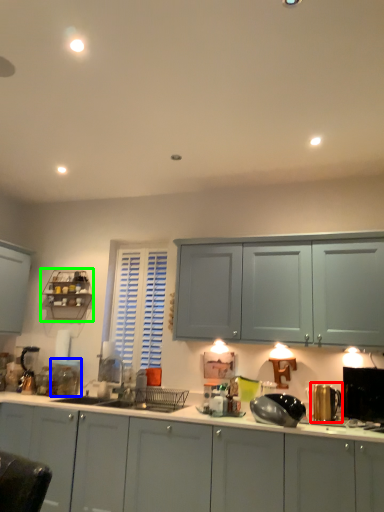
Question: Which is farther away from appliance (highlighted by a red box)? appliance (highlighted by a blue box) or shelf (highlighted by a green box)?

Choices:
 (A) appliance
 (B) shelf

Answer: (B)